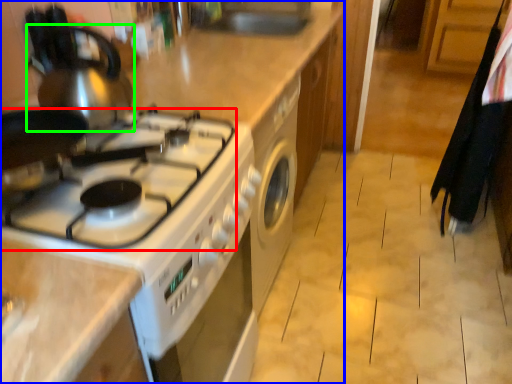
Question: Which object is the closest to the gas stove (highlighted by a red box)? Choose among these: kitchen appliance (highlighted by a blue box) or tea pot (highlighted by a green box).

Choices:
 (A) kitchen appliance
 (B) tea pot

Answer: (B)